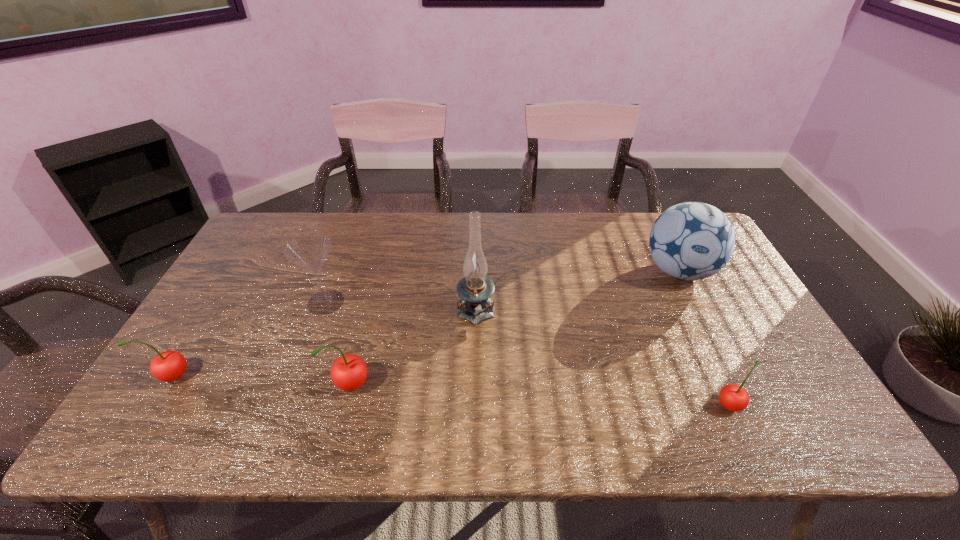
Locate an element on the screen. Image resolution: width=960 pixels, height=540 pixels. free space at the far edge is located at coordinates click(x=448, y=228).

This screenshot has width=960, height=540. Find the location of `vacant space at the near edge of the desktop`. vacant space at the near edge of the desktop is located at coordinates (635, 374).

This screenshot has width=960, height=540. I want to click on free space at the right edge of the desktop, so click(x=739, y=310).

This screenshot has width=960, height=540. In order to click on free region at the far left corner of the desktop in this screenshot , I will do `click(276, 253)`.

Identify the location of vacant point located between the fifth object from right to left and the shortest cherry. (528, 354).

This screenshot has width=960, height=540. In order to click on unoccupied position between the tallest object and the shortest object in this screenshot , I will do `click(603, 356)`.

The width and height of the screenshot is (960, 540). Find the location of `empty location between the soccer ball and the shortest object`. empty location between the soccer ball and the shortest object is located at coordinates (705, 338).

The width and height of the screenshot is (960, 540). I want to click on vacant region between the leftmost cherry and the shortest object, so pos(451,390).

Where is `unoccupied area between the leftmost cherry and the second cherry from right to left`? unoccupied area between the leftmost cherry and the second cherry from right to left is located at coordinates (262, 381).

Where is `vacant space in between the second cherry from left to right and the leftmost cherry`? The width and height of the screenshot is (960, 540). vacant space in between the second cherry from left to right and the leftmost cherry is located at coordinates (262, 381).